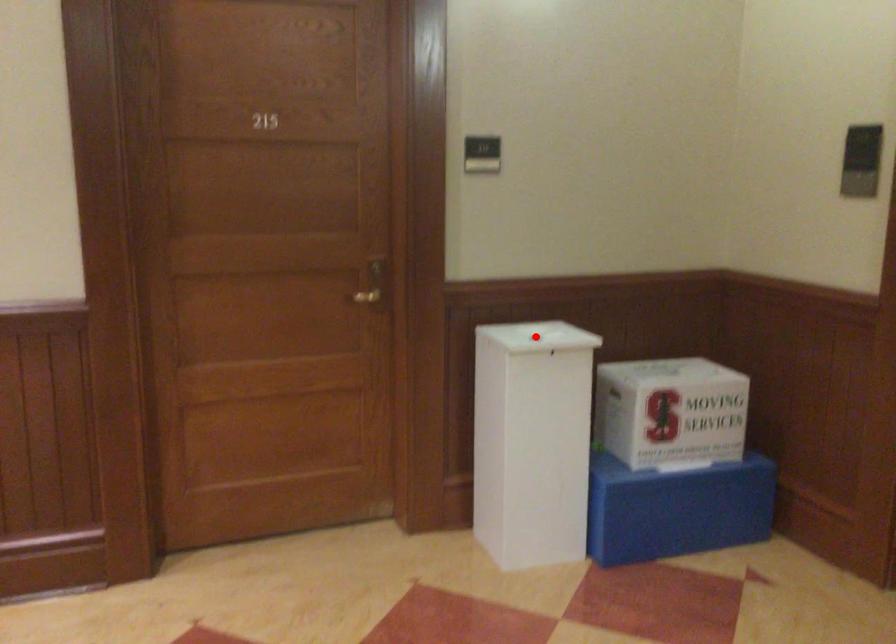
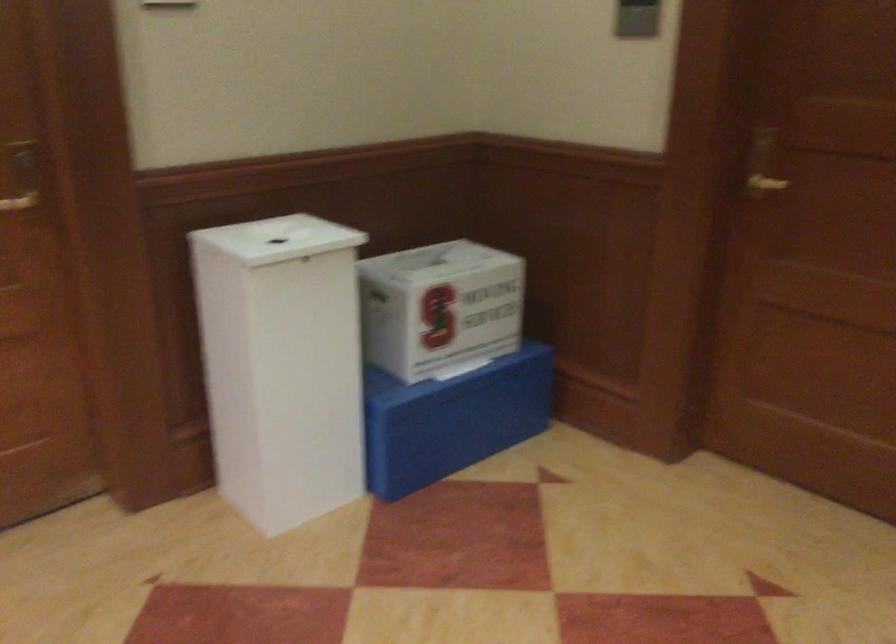
Question: A red point is marked in image1. In image2, is the corresponding 3D point closer to the camera or farther? Reply with the corresponding letter.

Choices:
 (A) The corresponding 3D point is closer.
 (B) The corresponding 3D point is farther.

Answer: (A)